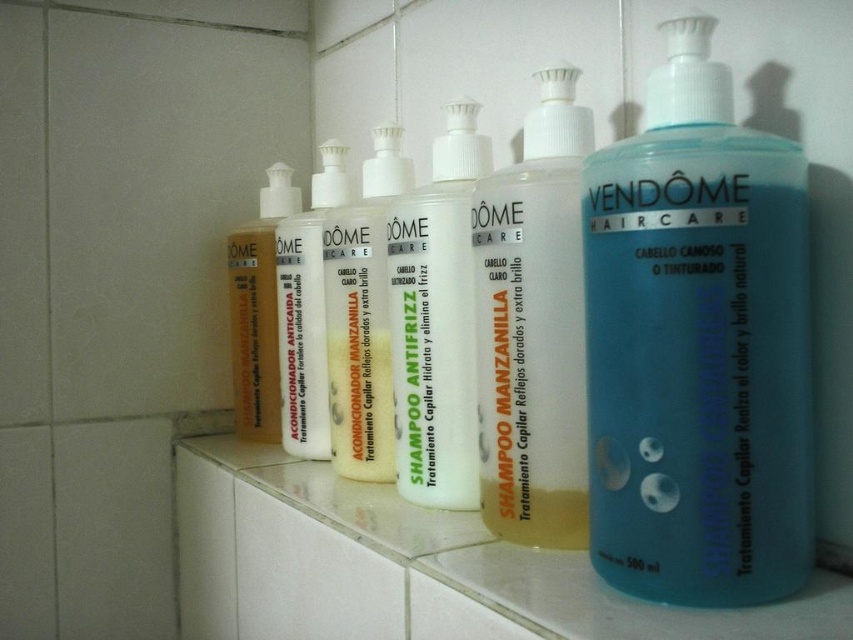
Question: Which point is closer to the camera?

Choices:
 (A) blue translucent shampoo at center
 (B) translucent plastic shampoo at left

Answer: (A)

Question: Considering the real-world distances, which object is farthest from the blue translucent shampoo at center?

Choices:
 (A) translucent plastic shampoo at center
 (B) translucent plastic shampoo at left
 (C) white opaque plastic shampoo bottle at center

Answer: (B)

Question: Is white opaque plastic shampoo bottle at center to the right of translucent plastic shampoo at left from the viewer's perspective?

Choices:
 (A) yes
 (B) no

Answer: (A)

Question: Can you confirm if blue translucent shampoo at center is positioned to the left of white matte conditioner at center?

Choices:
 (A) no
 (B) yes

Answer: (A)

Question: Is blue translucent shampoo at center to the left of clear glass counter top at center from the viewer's perspective?

Choices:
 (A) no
 (B) yes

Answer: (A)

Question: Which object is closer to the camera taking this photo?

Choices:
 (A) clear glass counter top at center
 (B) blue translucent shampoo at center

Answer: (A)